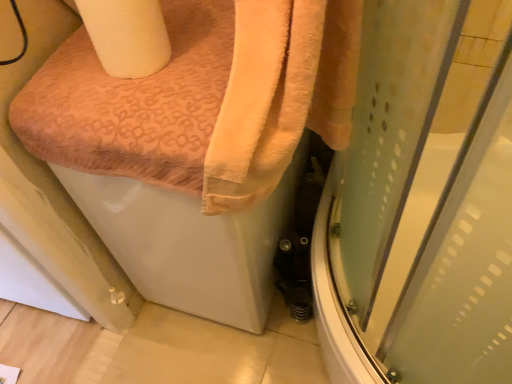
Question: Is orange soft towel at upper left in front of or behind orange textured towel at upper left in the image?

Choices:
 (A) behind
 (B) front

Answer: (B)

Question: Considering the positions of point (229, 117) and point (60, 64), is point (229, 117) closer or farther from the camera than point (60, 64)?

Choices:
 (A) closer
 (B) farther

Answer: (A)

Question: Based on their relative distances, which object is farther from the orange soft towel at upper left?

Choices:
 (A) orange textured towel at upper left
 (B) transparent plastic screen door at lower right
 (C) white matte toilet paper at upper left

Answer: (B)

Question: Which is farther from the transparent plastic screen door at lower right?

Choices:
 (A) orange textured towel at upper left
 (B) orange soft towel at upper left
 (C) white matte toilet paper at upper left

Answer: (C)